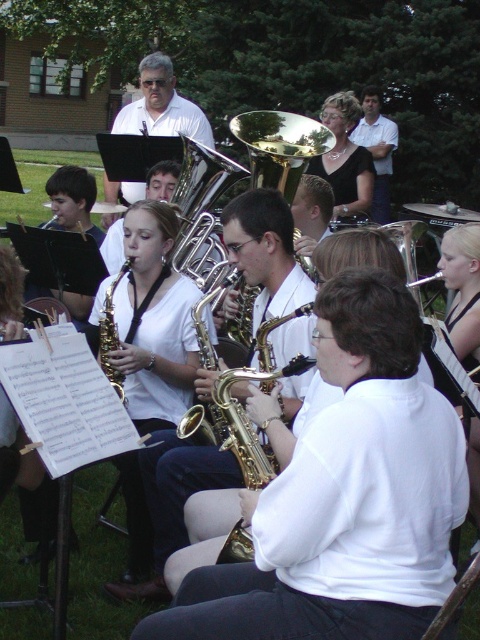
You are a music teacher trying to arrange the brass shiny trumpet at center and the gold shiny saxophone at center on a narrow music stand. Which instrument should you place first to ensure both can fit side by side?

The gold shiny saxophone at center should be placed first because its width is smaller than the brass shiny trumpet at center, allowing both to fit side by side on the narrow music stand.

You are standing at the origin point of the coordinate system in the image. You want to walk to the point labeled as point (201, 214). Will you pass by the point labeled as point (248, 129) first?

Yes, you will pass by point (248, 129) first because point (201, 214) is behind point (248, 129) in the image.